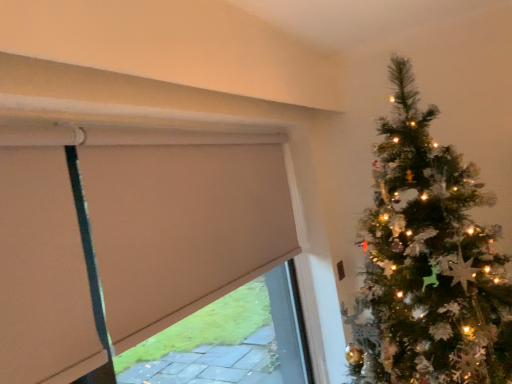
The width and height of the screenshot is (512, 384). What do you see at coordinates (182, 227) in the screenshot? I see `beige fabric curtain at upper left` at bounding box center [182, 227].

At what (x,y) coordinates should I click in order to perform the action: click on beige fabric curtain at upper left. Please return your answer as a coordinate pair (x, y). The height and width of the screenshot is (384, 512). Looking at the image, I should click on (182, 227).

What are the coordinates of `beige fabric curtain at upper left` in the screenshot? It's located at (182, 227).